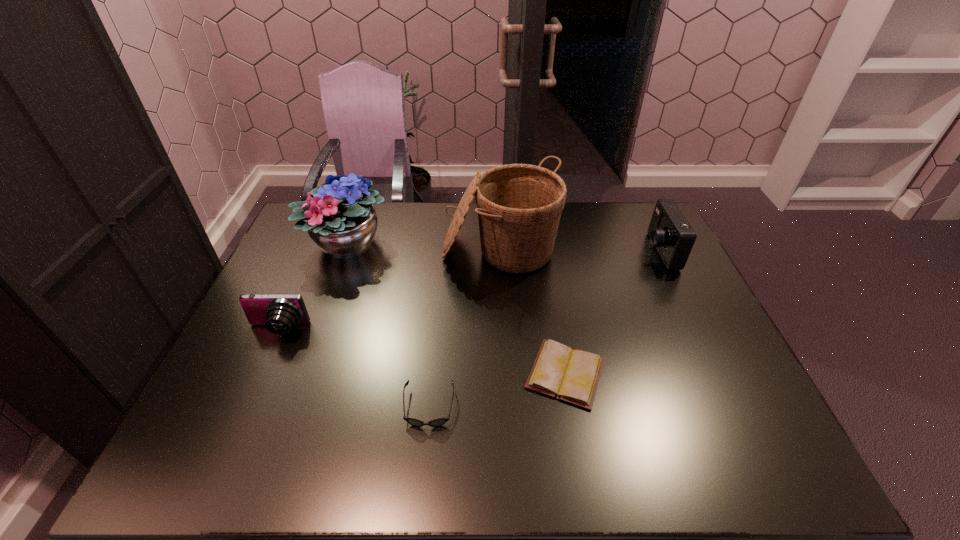
You are a GUI agent. You are given a task and a screenshot of the screen. Output one action in this format:
    pyautogui.click(x=<x>, y=<y>)
    Task: Click on the vacant point that satisfies the following two spatial constraints: 1. on the front-facing side of the fourth shortest object; 2. on the front side of the basket
    The width and height of the screenshot is (960, 540).
    Given the screenshot: What is the action you would take?
    pyautogui.click(x=660, y=253)

Find the location of a particular element. The height and width of the screenshot is (540, 960). vacant position in the image that satisfies the following two spatial constraints: 1. on the front-facing side of the farther camera; 2. on the lenses of the sunglasses is located at coordinates (734, 407).